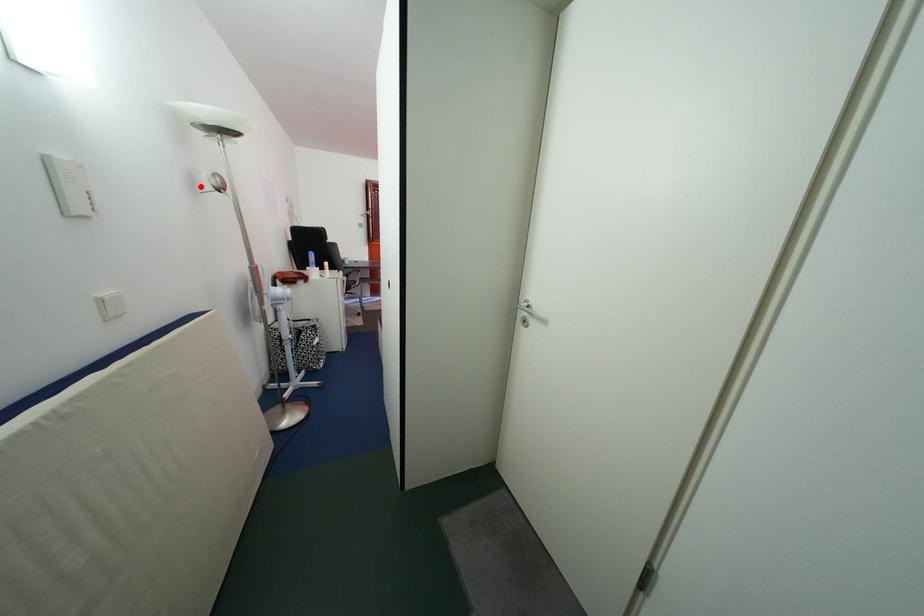
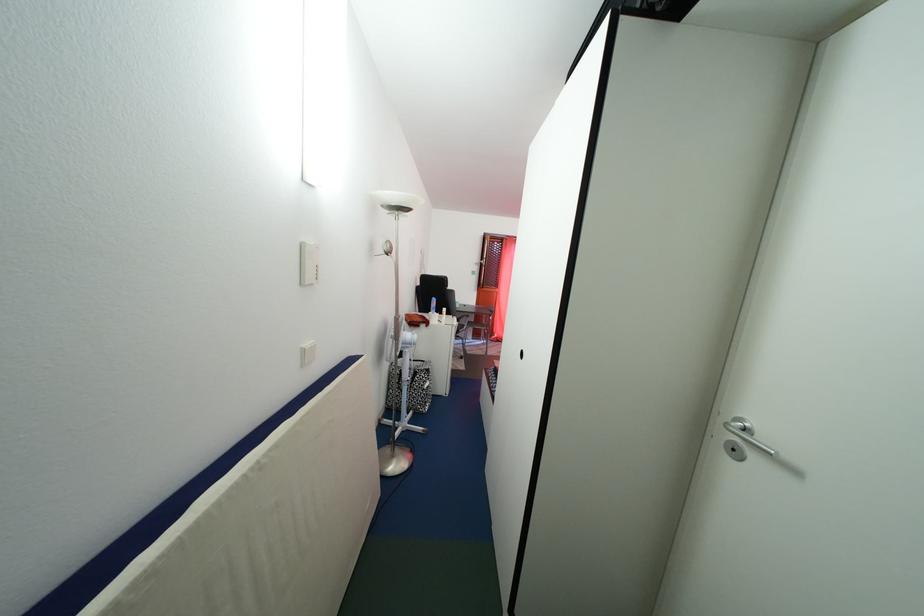
Locate, in the second image, the point that corresponds to the highlighted location in the first image.

(381, 253)